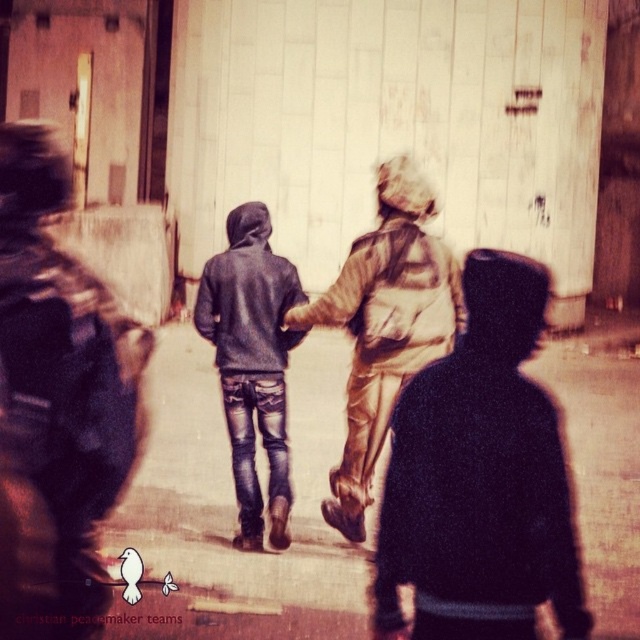
Between point (528, 577) and point (444, 276), which one is positioned behind?

The point (444, 276) is more distant.

Is point (477, 348) in front of point (356, 426)?

That is True.

Identify the location of black matte jacket at lower right. (481, 477).

Which is below, dark gray hoodie at center or gold metallic jacket at center?

dark gray hoodie at center is lower down.

Is point (81, 490) behind point (444, 326)?

No, (81, 490) is closer to viewer.

Between point (113, 372) and point (419, 346), which one is positioned behind?

Positioned behind is point (419, 346).

Find the location of `dark gray hoodie at center`. dark gray hoodie at center is located at coordinates (65, 365).

Does black matte jacket at lower right appear on the left side of matte gray hoodie at center?

Incorrect, black matte jacket at lower right is not on the left side of matte gray hoodie at center.

Between point (556, 596) and point (236, 374), which one is positioned behind?

Positioned behind is point (236, 374).

Find the location of `black matte jacket at lower right`. black matte jacket at lower right is located at coordinates (481, 477).